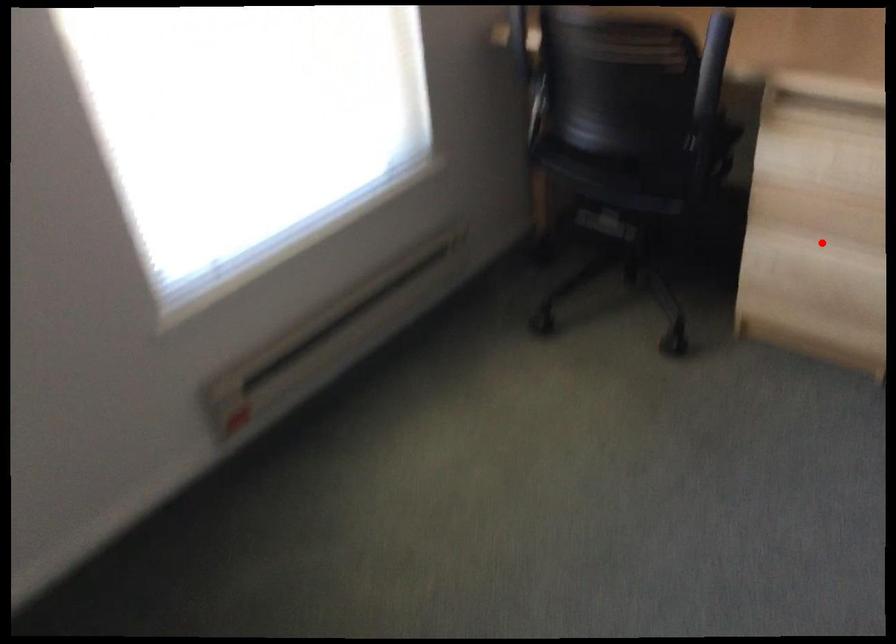
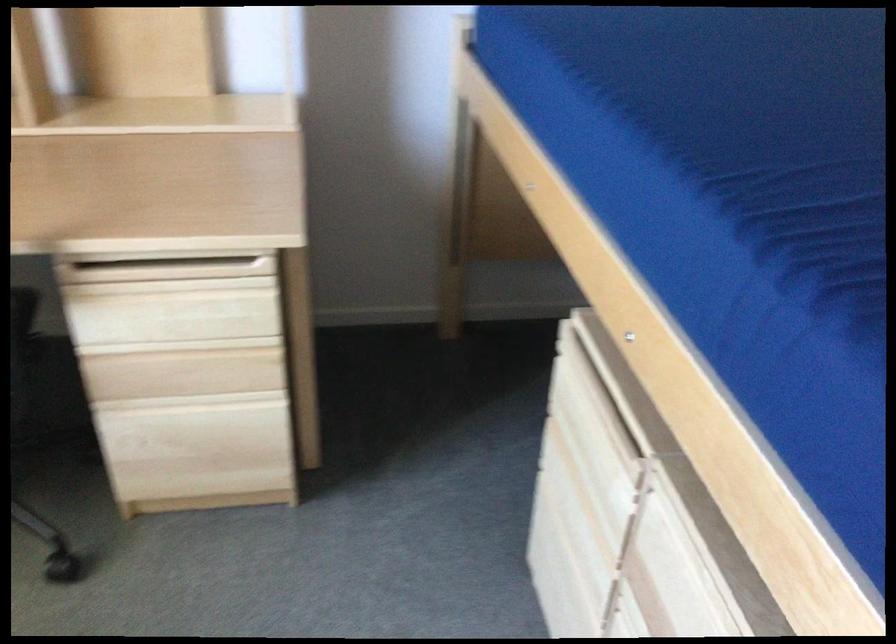
Question: I am providing you with two images of the same scene from different viewpoints. In image1, a red point is highlighted. Considering the same 3D point in image2, which of the following is correct?

Choices:
 (A) It is closer
 (B) It is farther

Answer: (A)